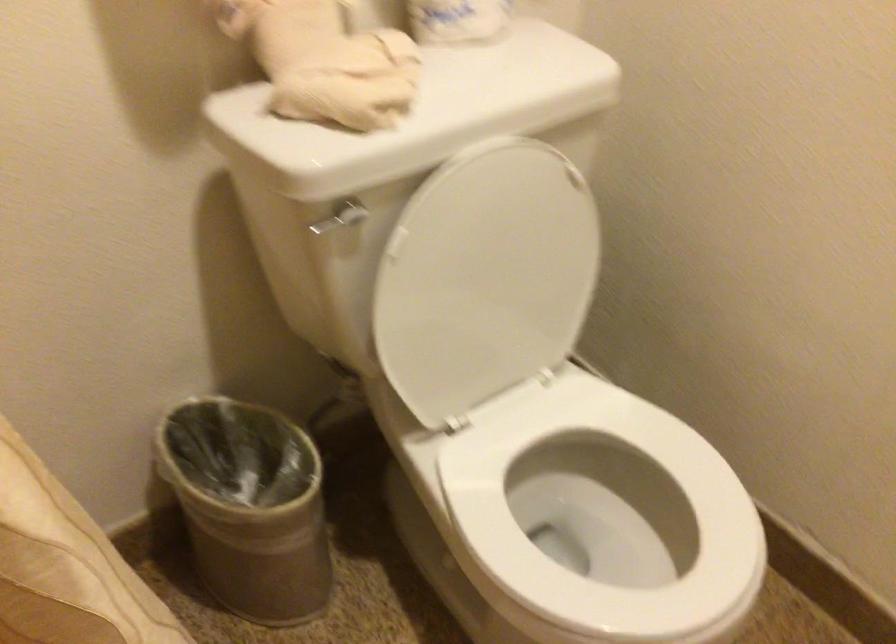
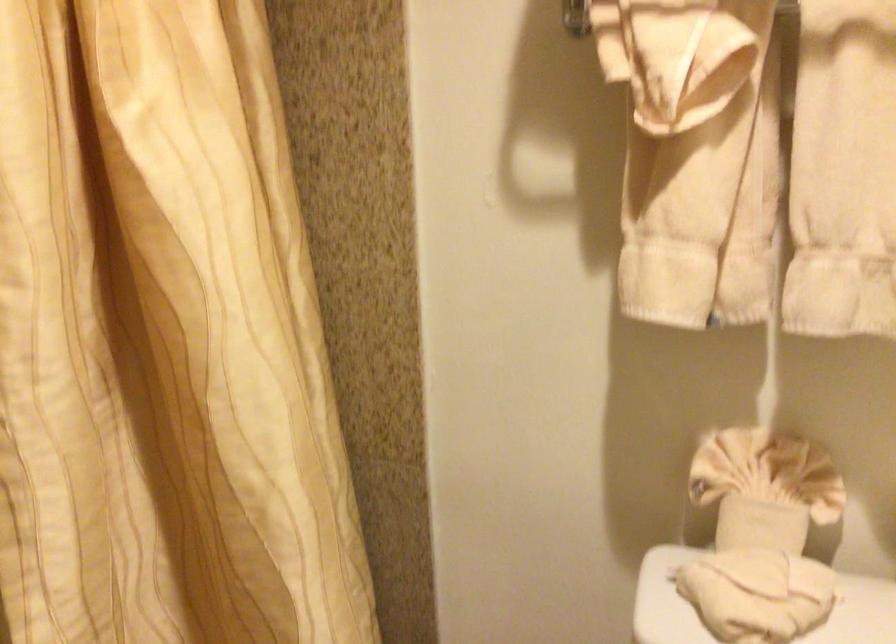
Question: The camera is either moving clockwise (left) or counter-clockwise (right) around the object. The first image is from the beginning of the video and the second image is from the end. Is the camera moving left or right when shooting the video?

Choices:
 (A) Left
 (B) Right

Answer: (B)